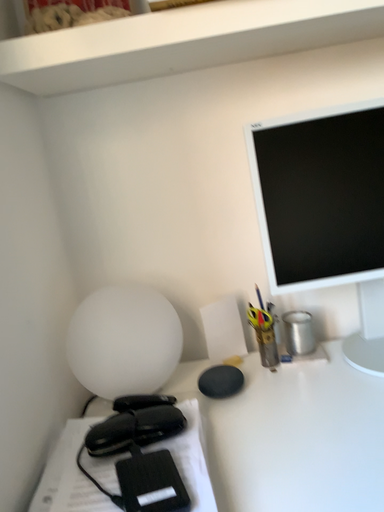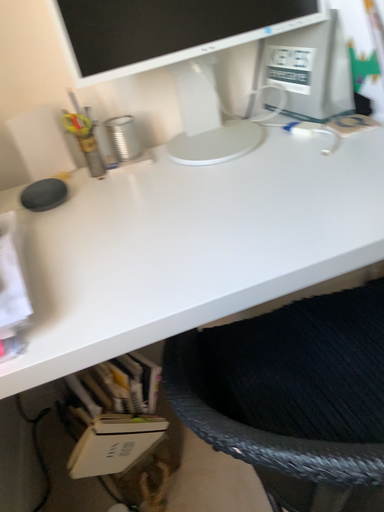
Question: How did the camera likely rotate when shooting the video?

Choices:
 (A) rotated downward
 (B) rotated upward

Answer: (A)